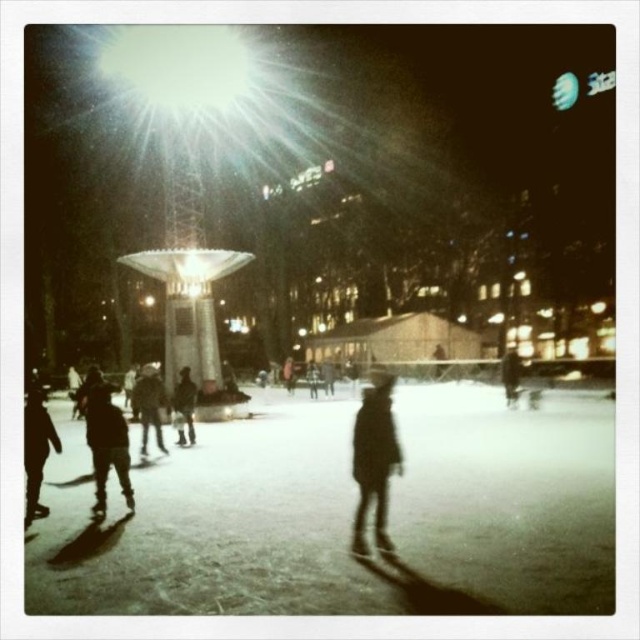
Consider the image. Is dark textured coat at center bigger than dark brown leather jacket at lower left?

Indeed, dark textured coat at center has a larger size compared to dark brown leather jacket at lower left.

Based on the photo, which is above, dark textured coat at center or dark brown leather jacket at lower left?

dark textured coat at center

Identify the location of dark textured coat at center. (374, 460).

Is point (160, 442) closer to viewer compared to point (518, 364)?

Yes, point (160, 442) is in front of point (518, 364).

Who is more forward, (150, 416) or (506, 368)?

Point (150, 416) is more forward.

Who is more distant from viewer, (164, 451) or (508, 355)?

The point (508, 355) is more distant.

Where is `dark fabric jacket at center`? The width and height of the screenshot is (640, 640). dark fabric jacket at center is located at coordinates (x=148, y=404).

Can you confirm if white matte snow at center is taller than dark brown leather jacket at lower left?

No.

Between white matte snow at center and dark brown leather jacket at lower left, which one is positioned lower?

Positioned lower is white matte snow at center.

You are a GUI agent. You are given a task and a screenshot of the screen. Output one action in this format:
    pyautogui.click(x=<x>, y=<y>)
    Task: Click on the white matte snow at center
    This screenshot has width=640, height=640.
    Given the screenshot: What is the action you would take?
    pyautogui.click(x=349, y=516)